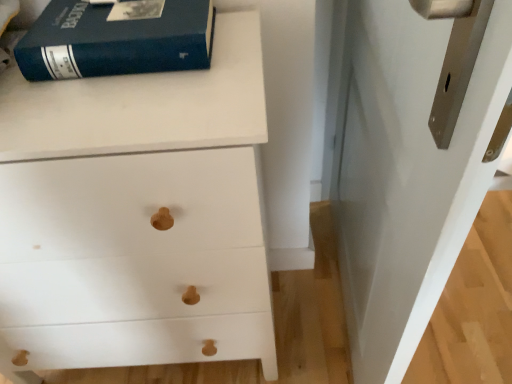
Question: Visually, is white glossy door at upper right positioned to the left or to the right of matte blue book at upper left?

Choices:
 (A) right
 (B) left

Answer: (A)

Question: Relative to matte blue book at upper left, is white glossy door at upper right in front or behind?

Choices:
 (A) behind
 (B) front

Answer: (B)

Question: Which object is positioned farthest from the white matte wood chest of drawers at upper left?

Choices:
 (A) white glossy door at upper right
 (B) matte blue book at upper left

Answer: (A)

Question: Based on their relative distances, which object is nearer to the white matte wood chest of drawers at upper left?

Choices:
 (A) white glossy door at upper right
 (B) matte blue book at upper left

Answer: (B)